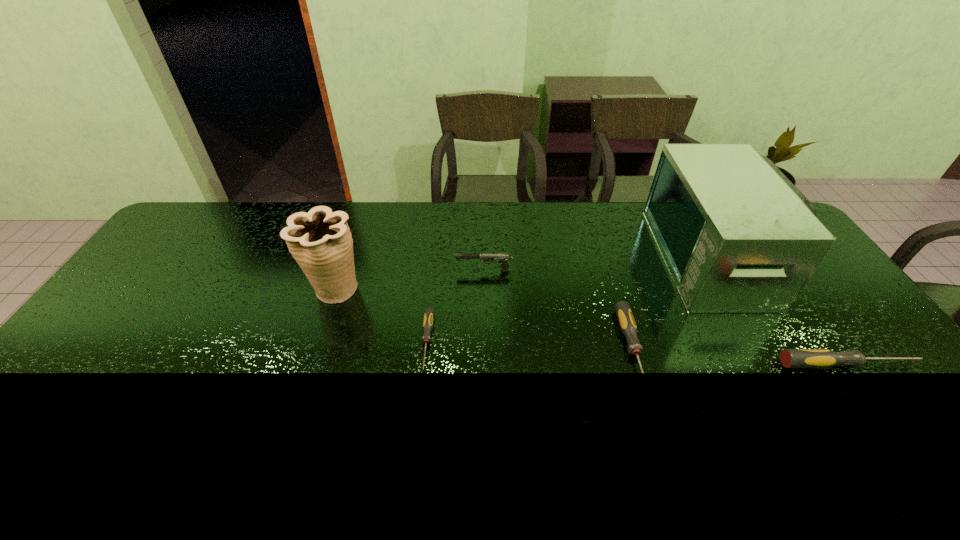
Please point out where to position a new screwdriver on the left to maintain spacing. Please provide its 2D coordinates. Your answer should be formatted as a tuple, i.e. [(x, y)], where the tuple contains the x and y coordinates of a point satisfying the conditions above.

[(229, 332)]